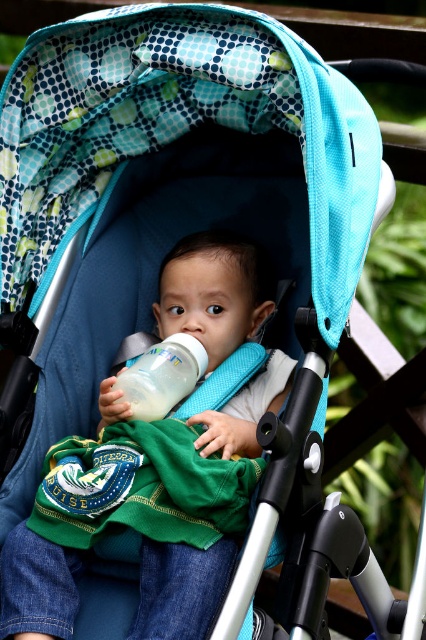
Question: Among these points, which one is nearest to the camera?

Choices:
 (A) (152, 528)
 (B) (138, 392)

Answer: (A)

Question: Does matte green shirt at center appear on the right side of white opaque bottle at center?

Choices:
 (A) yes
 (B) no

Answer: (A)

Question: Which point is farther to the camera?

Choices:
 (A) click(172, 385)
 (B) click(238, 266)

Answer: (B)

Question: Which point is farther from the camera taking this photo?

Choices:
 (A) (152, 403)
 (B) (235, 340)

Answer: (B)

Question: Can you confirm if matte green shirt at center is positioned to the left of white opaque bottle at center?

Choices:
 (A) no
 (B) yes

Answer: (A)

Question: Can you confirm if matte green shirt at center is positioned above white opaque bottle at center?

Choices:
 (A) no
 (B) yes

Answer: (A)